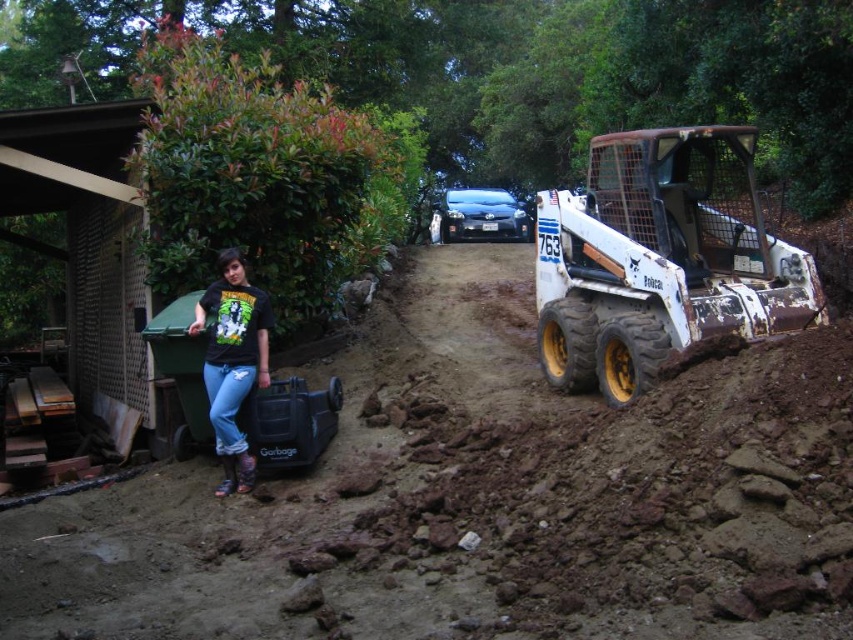
Between white rusty tractor at right and black matte shirt at left, which one is positioned lower?

Positioned lower is black matte shirt at left.

Between point (751, 257) and point (257, 330), which one is positioned behind?

The point (751, 257) is more distant.

At what (x,y) coordinates should I click in order to perform the action: click on white rusty tractor at right. Please return your answer as a coordinate pair (x, y). Looking at the image, I should click on (660, 259).

Which is behind, point (680, 621) or point (758, 292)?

The point (758, 292) is behind.

The width and height of the screenshot is (853, 640). What do you see at coordinates (473, 497) in the screenshot?
I see `brown clay dirt at center` at bounding box center [473, 497].

The height and width of the screenshot is (640, 853). What do you see at coordinates (473, 497) in the screenshot? I see `brown clay dirt at center` at bounding box center [473, 497].

The height and width of the screenshot is (640, 853). Identify the location of brown clay dirt at center. (473, 497).

Does brown clay dirt at center have a smaller size compared to black matte shirt at left?

No, brown clay dirt at center is not smaller than black matte shirt at left.

Is brown clay dirt at center to the right of black matte shirt at left from the viewer's perspective?

Correct, you'll find brown clay dirt at center to the right of black matte shirt at left.

The image size is (853, 640). I want to click on brown clay dirt at center, so click(x=473, y=497).